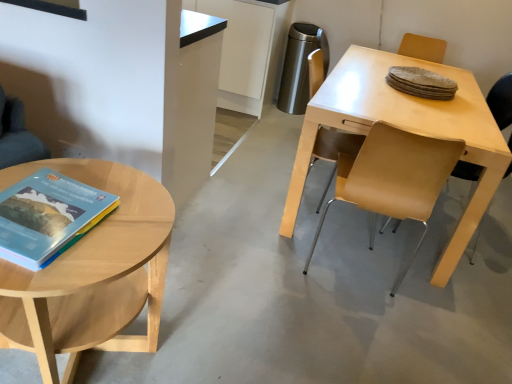
Question: Should I look upward or downward to see light brown wood coffee table at left?

Choices:
 (A) up
 (B) down

Answer: (B)

Question: Would you consider light brown leather chair at right, positioned as the 2th chair in left-to-right order, to be distant from matte hardcover book at left?

Choices:
 (A) yes
 (B) no

Answer: (A)

Question: From the image's perspective, is light brown leather chair at right, positioned as the 2th chair in left-to-right order, on top of matte hardcover book at left?

Choices:
 (A) yes
 (B) no

Answer: (A)

Question: From the image's perspective, is light brown leather chair at right, positioned as the 2th chair in left-to-right order, located beneath matte hardcover book at left?

Choices:
 (A) yes
 (B) no

Answer: (B)

Question: Does light brown leather chair at right, which appears as the first chair when viewed from the right, have a greater height compared to matte hardcover book at left?

Choices:
 (A) yes
 (B) no

Answer: (A)

Question: Can you confirm if light brown leather chair at right, positioned as the 2th chair in left-to-right order, is positioned to the right of matte hardcover book at left?

Choices:
 (A) no
 (B) yes

Answer: (B)

Question: Considering the relative sizes of light brown leather chair at right, which appears as the first chair when viewed from the right, and matte hardcover book at left in the image provided, is light brown leather chair at right, which appears as the first chair when viewed from the right, wider than matte hardcover book at left?

Choices:
 (A) yes
 (B) no

Answer: (A)

Question: From a real-world perspective, is matte hardcover book at left on light brown wood coffee table at left?

Choices:
 (A) yes
 (B) no

Answer: (A)

Question: Can you confirm if matte hardcover book at left is positioned to the left of light brown wood coffee table at left?

Choices:
 (A) yes
 (B) no

Answer: (B)

Question: Does matte hardcover book at left have a lesser width compared to light brown wood coffee table at left?

Choices:
 (A) yes
 (B) no

Answer: (A)

Question: Does matte hardcover book at left turn towards light brown wood coffee table at left?

Choices:
 (A) yes
 (B) no

Answer: (B)

Question: Does matte hardcover book at left touch light brown wood coffee table at left?

Choices:
 (A) no
 (B) yes

Answer: (A)

Question: From a real-world perspective, is matte hardcover book at left beneath light brown wood coffee table at left?

Choices:
 (A) no
 (B) yes

Answer: (A)

Question: Can we say light brown leather chair at right, positioned as the 2th chair in left-to-right order, lies outside light wood table at right?

Choices:
 (A) no
 (B) yes

Answer: (A)